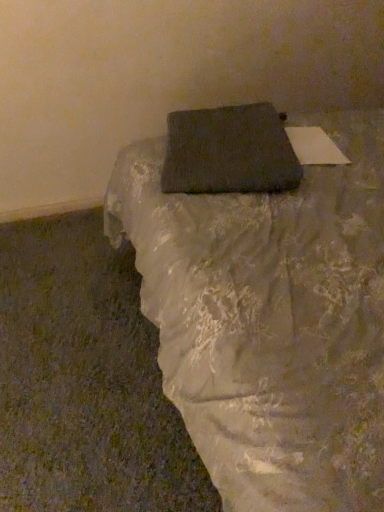
Question: Is dark gray fabric pillow at center in front of or behind matte black book at upper center in the image?

Choices:
 (A) behind
 (B) front

Answer: (A)

Question: From the image's perspective, is dark gray fabric pillow at center above or below matte black book at upper center?

Choices:
 (A) above
 (B) below

Answer: (A)

Question: Is dark gray fabric pillow at center inside or outside of matte black book at upper center?

Choices:
 (A) outside
 (B) inside

Answer: (B)

Question: Considering the positions of point (236, 242) and point (258, 170), is point (236, 242) closer or farther from the camera than point (258, 170)?

Choices:
 (A) farther
 (B) closer

Answer: (B)

Question: Which is correct: matte black book at upper center is inside dark gray fabric pillow at center, or outside of it?

Choices:
 (A) outside
 (B) inside

Answer: (A)

Question: Visually, is matte black book at upper center positioned to the left or to the right of dark gray fabric pillow at center?

Choices:
 (A) left
 (B) right

Answer: (B)

Question: Is matte black book at upper center wider or thinner than dark gray fabric pillow at center?

Choices:
 (A) thin
 (B) wide

Answer: (B)